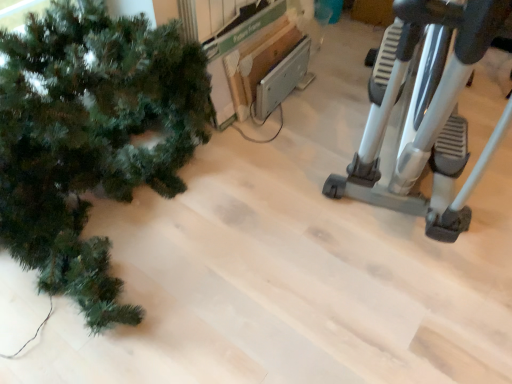
The image size is (512, 384). What are the coordinates of `free location to the left of silver metallic stationary bicycle at right` in the screenshot? It's located at (284, 170).